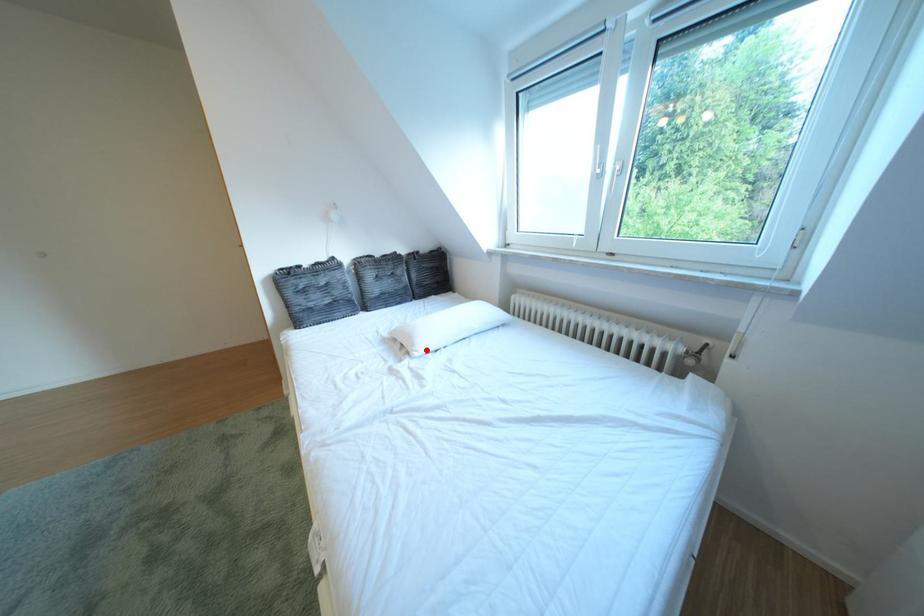
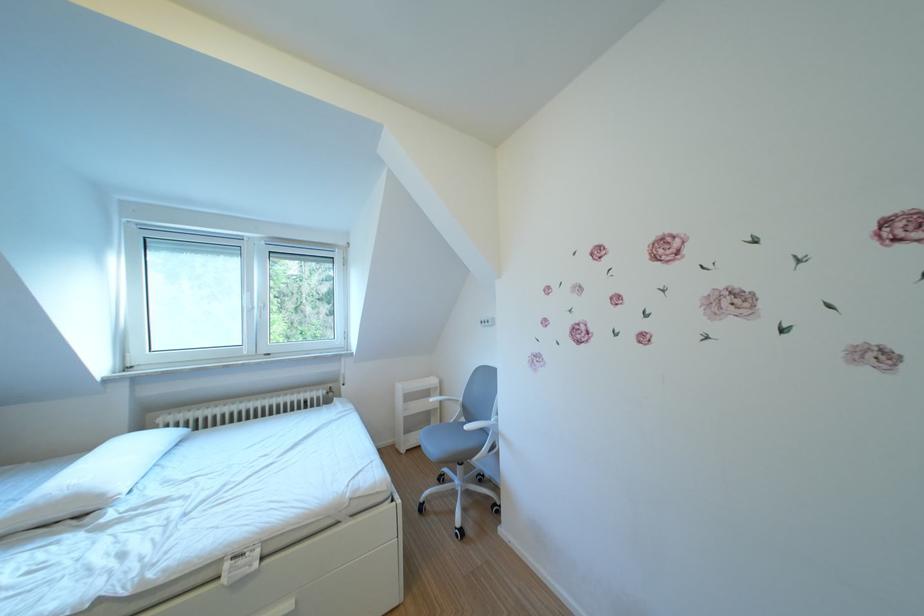
Find the pixel in the second image that matches the highlighted location in the first image.

(115, 501)